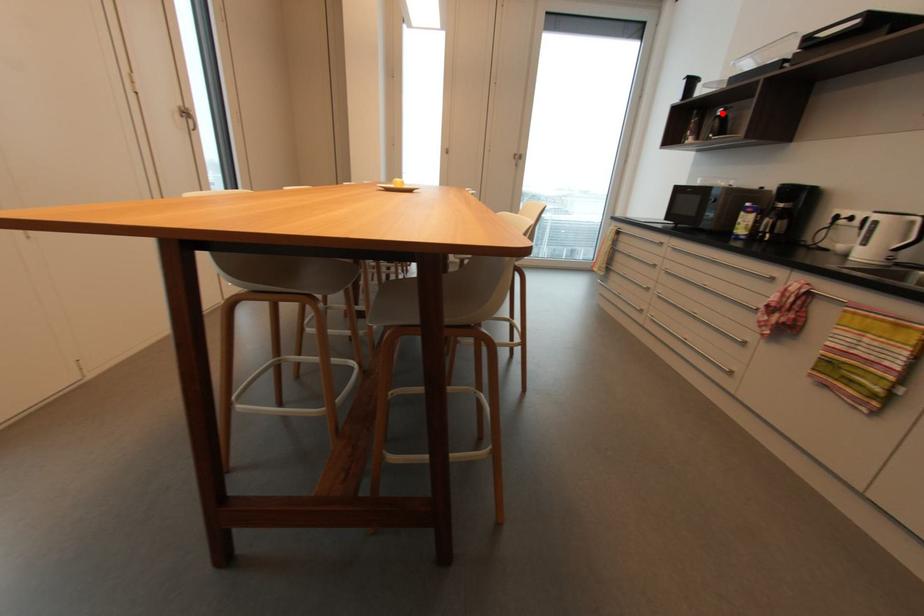
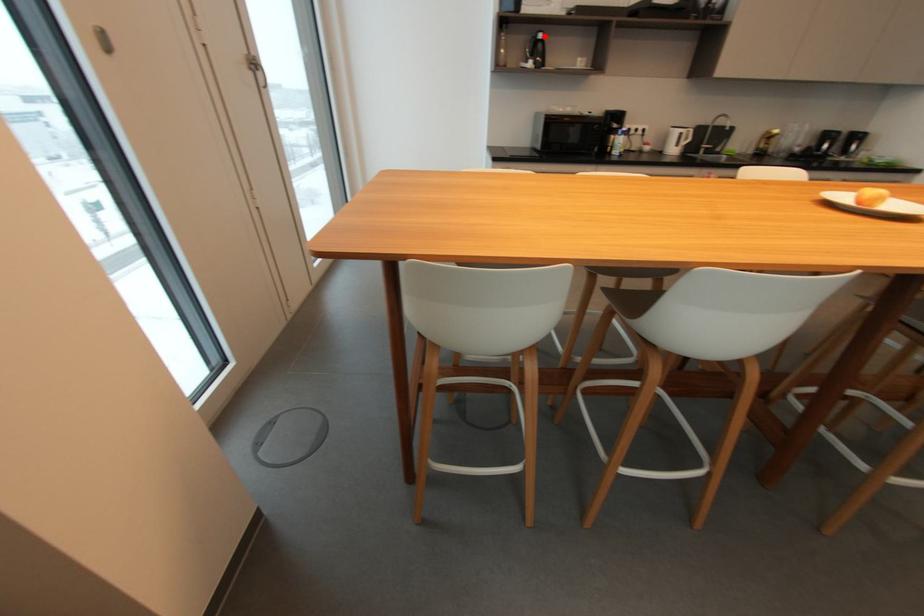
From the picture: I am providing you with two images of the same scene from different viewpoints. A red point is marked on the first image and another point is marked on the second image. Are the points marked in image1 and image2 representing the same 3D position?

Yes